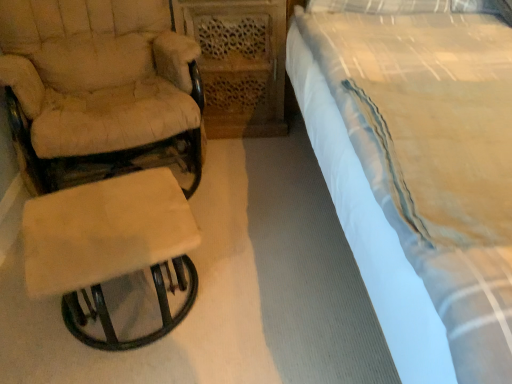
Find the location of a particular element. Image resolution: width=512 pixels, height=384 pixels. free spot to the right of beige fabric chair at left is located at coordinates (266, 206).